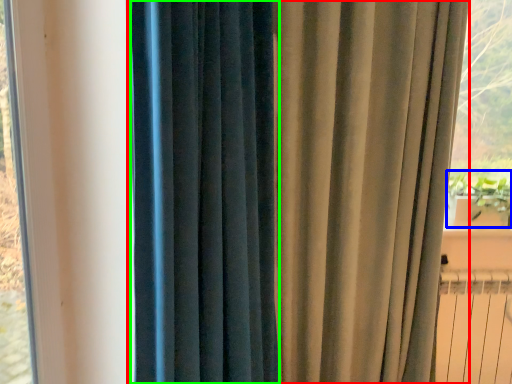
Question: Considering the real-world distances, which object is farthest from curtain (highlighted by a red box)? plant (highlighted by a blue box) or curtain (highlighted by a green box)?

Choices:
 (A) plant
 (B) curtain

Answer: (A)